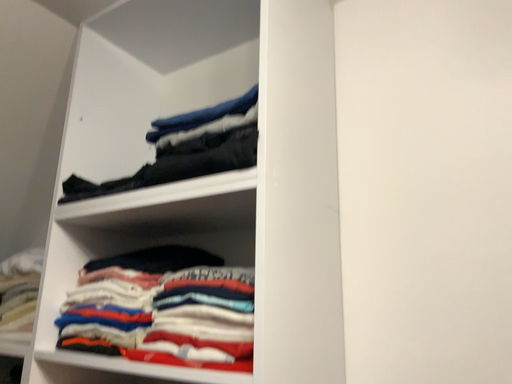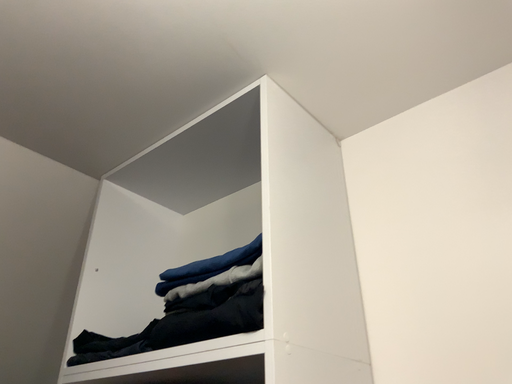
Question: Which way did the camera rotate in the video?

Choices:
 (A) rotated downward
 (B) rotated upward

Answer: (B)